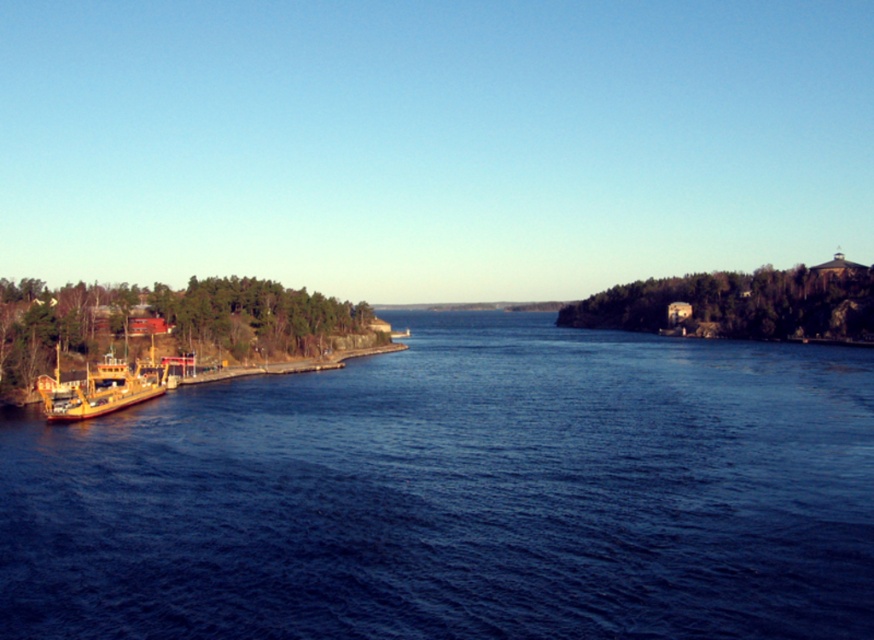
Question: Does blue water at center appear on the right side of yellow matte boat at left?

Choices:
 (A) no
 (B) yes

Answer: (B)

Question: Does blue water at center appear under yellow matte boat at left?

Choices:
 (A) no
 (B) yes

Answer: (B)

Question: Which point is farther to the camera?

Choices:
 (A) (108, 436)
 (B) (155, 376)

Answer: (B)

Question: Is blue water at center closer to the viewer compared to yellow matte boat at left?

Choices:
 (A) no
 (B) yes

Answer: (B)

Question: Which point is farther to the camera?

Choices:
 (A) yellow matte boat at left
 (B) blue water at center

Answer: (A)

Question: Among these points, which one is farthest from the camera?

Choices:
 (A) (580, 333)
 (B) (59, 403)

Answer: (A)